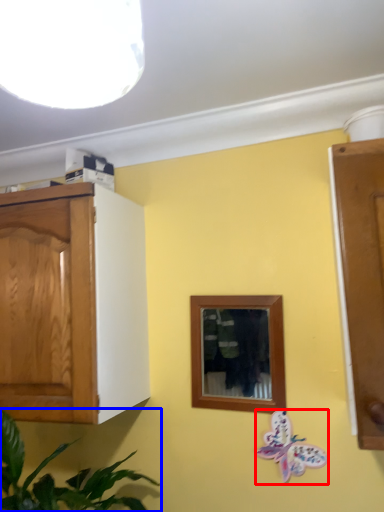
Question: Among these objects, which one is farthest to the camera, butterfly (highlighted by a red box) or houseplant (highlighted by a blue box)?

Choices:
 (A) butterfly
 (B) houseplant

Answer: (A)